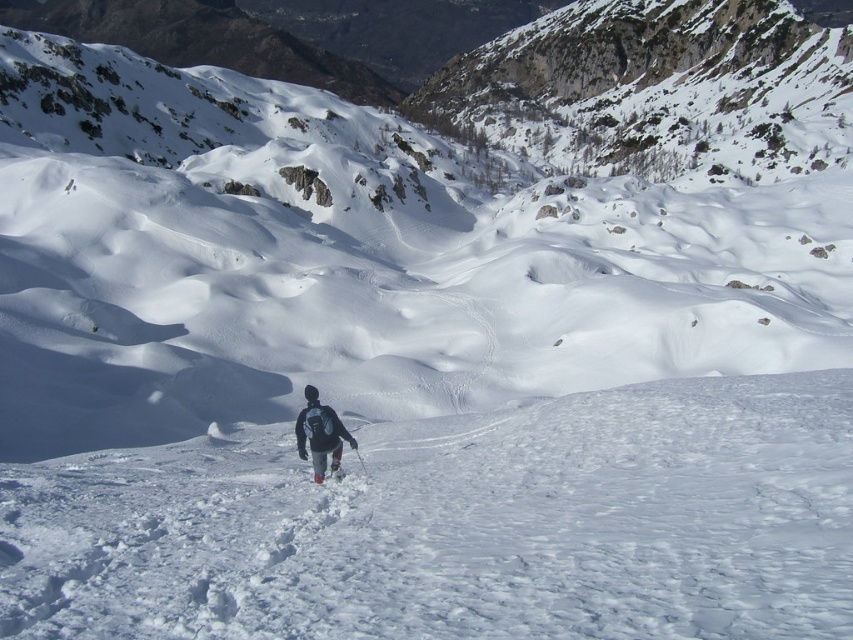
Question: Among these objects, which one is farthest from the camera?

Choices:
 (A) gray fabric backpack at center
 (B) white matte ski at center

Answer: (B)

Question: Which point is closer to the camera?

Choices:
 (A) white matte ski at center
 (B) gray fabric backpack at center

Answer: (B)

Question: Is gray fabric backpack at center further to the viewer compared to white matte ski at center?

Choices:
 (A) yes
 (B) no

Answer: (B)

Question: Does gray fabric backpack at center appear on the left side of white matte ski at center?

Choices:
 (A) no
 (B) yes

Answer: (B)

Question: Which point is farther to the camera?

Choices:
 (A) (323, 472)
 (B) (338, 468)

Answer: (B)

Question: Does gray fabric backpack at center come behind white matte ski at center?

Choices:
 (A) yes
 (B) no

Answer: (B)